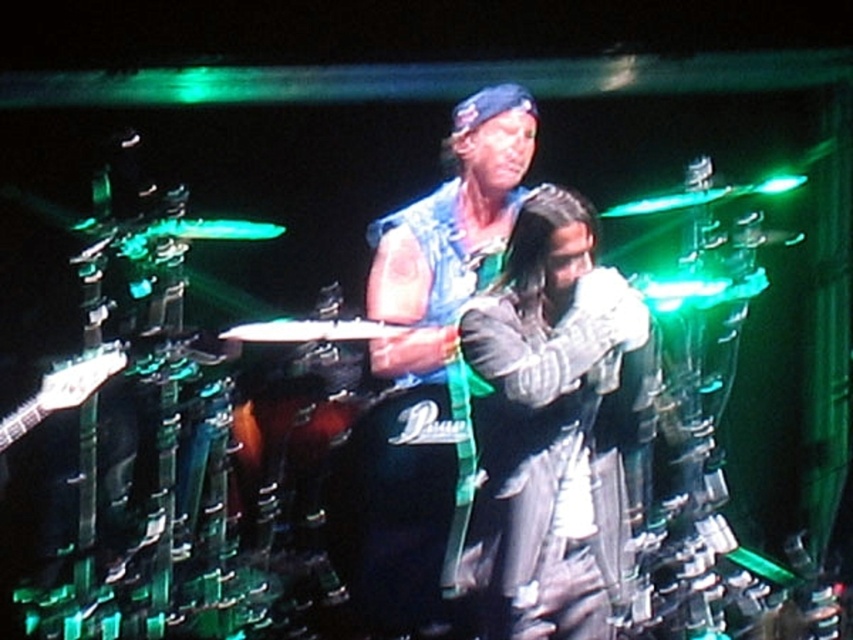
Which of these two, leather jacket at center or black leather drum at center, stands shorter?

black leather drum at center

Which is behind, point (566, 621) or point (430, 385)?

Positioned behind is point (430, 385).

I want to click on leather jacket at center, so click(x=546, y=417).

Between denim vest at center and black leather drum at center, which one appears on the right side from the viewer's perspective?

From the viewer's perspective, denim vest at center appears more on the right side.

Is denim vest at center smaller than black leather drum at center?

Actually, denim vest at center might be larger than black leather drum at center.

This screenshot has width=853, height=640. Identify the location of denim vest at center. (428, 353).

At what (x,y) coordinates should I click in order to perform the action: click on denim vest at center. Please return your answer as a coordinate pair (x, y). This screenshot has height=640, width=853. Looking at the image, I should click on (428, 353).

Between leather jacket at center and denim vest at center, which one is positioned lower?

leather jacket at center is lower down.

Does point (624, 288) come in front of point (410, 380)?

Yes, it is.

You are a GUI agent. You are given a task and a screenshot of the screen. Output one action in this format:
    pyautogui.click(x=<x>, y=<y>)
    Task: Click on the leather jacket at center
    The image size is (853, 640).
    Given the screenshot: What is the action you would take?
    pyautogui.click(x=546, y=417)